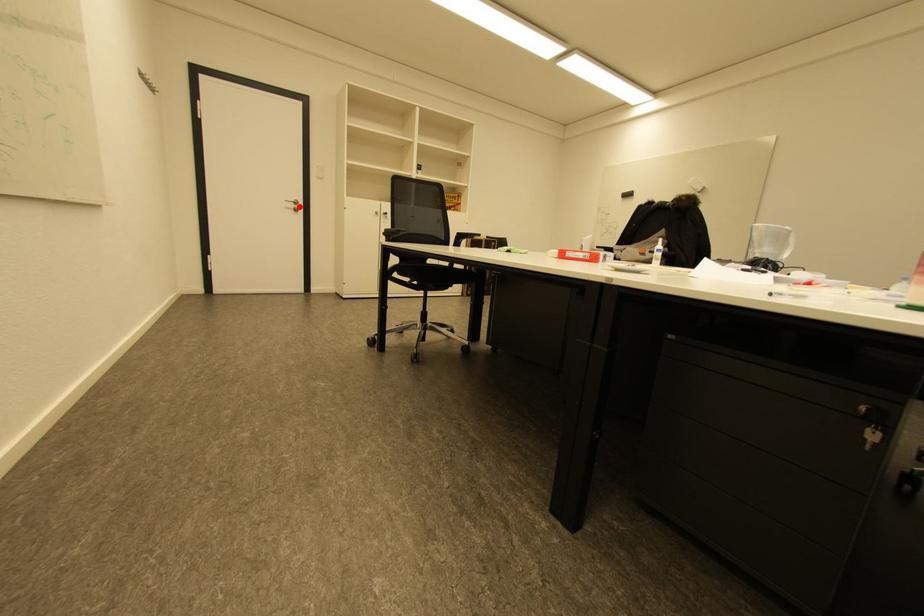
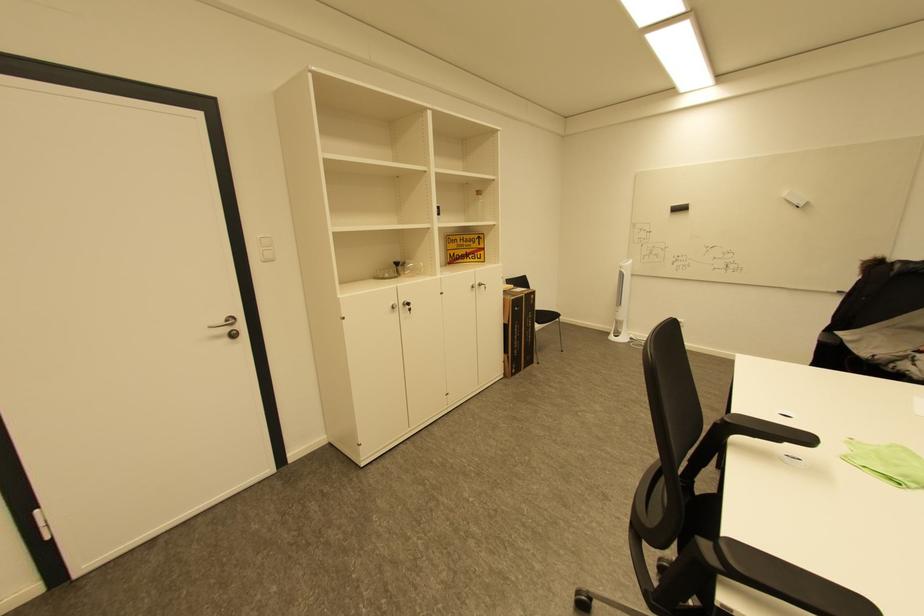
Locate, in the second image, the point that corresponds to the highlighted location in the first image.

(233, 330)